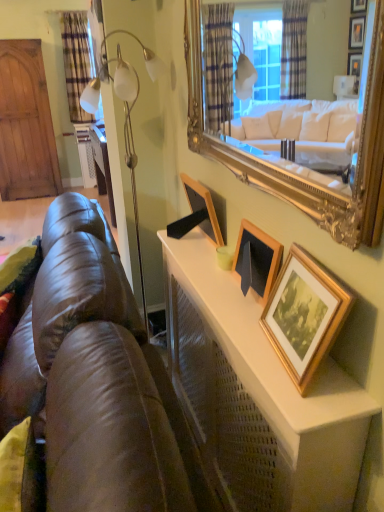
Question: From a real-world perspective, is gold wooden picture frame at upper right, the first picture frame in the right-to-left sequence, on brown leather couch at lower left?

Choices:
 (A) no
 (B) yes

Answer: (B)

Question: Is brown leather couch at lower left completely or partially inside gold wooden picture frame at upper right, the third picture frame positioned from the left?

Choices:
 (A) yes
 (B) no

Answer: (B)

Question: Does gold wooden picture frame at upper right, the third picture frame positioned from the left, have a greater width compared to brown leather couch at lower left?

Choices:
 (A) no
 (B) yes

Answer: (A)

Question: Is gold wooden picture frame at upper right, which is the third picture frame from back to front, with brown leather couch at lower left?

Choices:
 (A) no
 (B) yes

Answer: (A)

Question: Is gold wooden picture frame at upper right, the third picture frame positioned from the left, behind brown leather couch at lower left?

Choices:
 (A) no
 (B) yes

Answer: (B)

Question: Is point (274, 274) closer or farther from the camera than point (145, 480)?

Choices:
 (A) farther
 (B) closer

Answer: (A)

Question: Is wooden picture frame at center, which is the second picture frame in front-to-back order, bigger or smaller than brown leather couch at lower left?

Choices:
 (A) big
 (B) small

Answer: (B)

Question: Is wooden picture frame at center, which appears as the second picture frame when viewed from the back, to the left or to the right of brown leather couch at lower left in the image?

Choices:
 (A) right
 (B) left

Answer: (A)

Question: From their relative heights in the image, would you say wooden picture frame at center, which is the second picture frame in front-to-back order, is taller or shorter than brown leather couch at lower left?

Choices:
 (A) tall
 (B) short

Answer: (B)

Question: Relative to brown leather couch at lower left, is plaid fabric curtain at upper left in front or behind?

Choices:
 (A) behind
 (B) front

Answer: (A)

Question: Looking at their shapes, would you say plaid fabric curtain at upper left is wider or thinner than brown leather couch at lower left?

Choices:
 (A) wide
 (B) thin

Answer: (B)

Question: In the image, is plaid fabric curtain at upper left on the left side or the right side of brown leather couch at lower left?

Choices:
 (A) right
 (B) left

Answer: (B)

Question: From the image's perspective, is plaid fabric curtain at upper left located above or below brown leather couch at lower left?

Choices:
 (A) below
 (B) above

Answer: (B)

Question: From a real-world perspective, relative to wooden picture frame at center, which appears as the second picture frame when viewed from the back, is gold wooden picture frame at upper right, the third picture frame positioned from the left, vertically above or below?

Choices:
 (A) above
 (B) below

Answer: (A)

Question: Based on their sizes in the image, would you say gold wooden picture frame at upper right, the first picture frame in the right-to-left sequence, is bigger or smaller than wooden picture frame at center, which is the second picture frame in front-to-back order?

Choices:
 (A) small
 (B) big

Answer: (B)